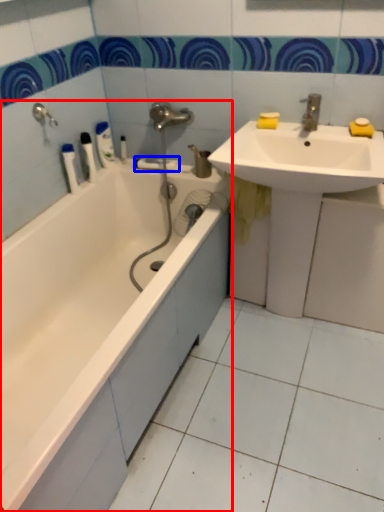
Question: Which object appears farthest to the camera in this image, bathtub (highlighted by a red box) or towel bar (highlighted by a blue box)?

Choices:
 (A) bathtub
 (B) towel bar

Answer: (B)